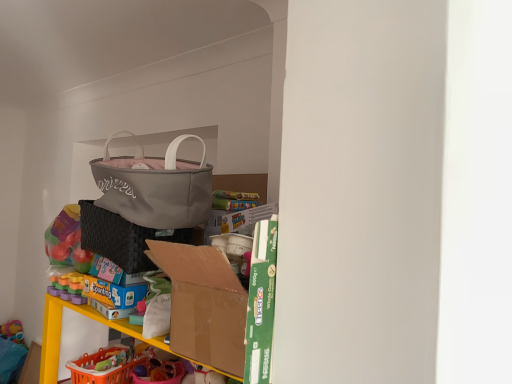
The image size is (512, 384). Describe the element at coordinates (203, 307) in the screenshot. I see `cardboard box at center` at that location.

This screenshot has width=512, height=384. Find the location of `cardboard box at center`. cardboard box at center is located at coordinates (203, 307).

The width and height of the screenshot is (512, 384). In order to click on cardboard box at center in this screenshot , I will do `click(203, 307)`.

Is cardboard box at center looking in the opposite direction of matte gray handbag at upper center?

No, cardboard box at center's orientation is not away from matte gray handbag at upper center.

Is the surface of cardboard box at center in direct contact with matte gray handbag at upper center?

No, cardboard box at center is not beside matte gray handbag at upper center.

From a real-world perspective, which object rests below the other?

cardboard box at center is physically lower.

Which of these two, cardboard box at center or matte gray handbag at upper center, is smaller?

Smaller between the two is matte gray handbag at upper center.

Is black woven laundry basket at center far away from cardboard box at center?

No, black woven laundry basket at center is not far from cardboard box at center.

Consider the image. Measure the distance between black woven laundry basket at center and cardboard box at center.

They are 9.94 inches apart.

Does point (128, 236) lie behind point (225, 307)?

Yes, point (128, 236) is farther from viewer.

In the image, is black woven laundry basket at center positioned in front of or behind cardboard box at center?

Clearly, black woven laundry basket at center is behind cardboard box at center.

From the image's perspective, would you say cardboard box at center is shown under black woven laundry basket at center?

Yes, from the image's perspective, cardboard box at center is beneath black woven laundry basket at center.

Can you confirm if cardboard box at center is shorter than black woven laundry basket at center?

No, cardboard box at center is not shorter than black woven laundry basket at center.

From a real-world perspective, which is physically above, cardboard box at center or black woven laundry basket at center?

From a 3D spatial view, black woven laundry basket at center is above.

Which is behind, point (205, 169) or point (87, 241)?

The point (87, 241) is farther.

Is matte gray handbag at upper center facing away from black woven laundry basket at center?

matte gray handbag at upper center does not have its back to black woven laundry basket at center.

Considering the relative sizes of matte gray handbag at upper center and black woven laundry basket at center in the image provided, is matte gray handbag at upper center bigger than black woven laundry basket at center?

Yes, matte gray handbag at upper center is bigger than black woven laundry basket at center.

Considering the sizes of objects matte gray handbag at upper center and black woven laundry basket at center in the image provided, who is thinner, matte gray handbag at upper center or black woven laundry basket at center?

Thinner between the two is matte gray handbag at upper center.

Which object is positioned more to the right, black woven laundry basket at center or matte gray handbag at upper center?

Positioned to the right is black woven laundry basket at center.

Considering the sizes of objects black woven laundry basket at center and matte gray handbag at upper center in the image provided, who is taller, black woven laundry basket at center or matte gray handbag at upper center?

matte gray handbag at upper center is taller.

Is black woven laundry basket at center positioned in front of matte gray handbag at upper center?

No, black woven laundry basket at center is further to the viewer.

Is black woven laundry basket at center outside of matte gray handbag at upper center?

Indeed, black woven laundry basket at center is completely outside matte gray handbag at upper center.

Based on their sizes in the image, would you say matte gray handbag at upper center is bigger or smaller than cardboard box at center?

Considering their sizes, matte gray handbag at upper center takes up less space than cardboard box at center.

Considering the relative sizes of matte gray handbag at upper center and cardboard box at center in the image provided, is matte gray handbag at upper center taller than cardboard box at center?

Yes.

Image resolution: width=512 pixels, height=384 pixels. In order to click on bookshelf that appears below the matte gray handbag at upper center (from a real-world perspective) in this screenshot , I will do `click(203, 307)`.

Identify the location of bookshelf that appears in front of the black woven laundry basket at center. Image resolution: width=512 pixels, height=384 pixels. (203, 307).

Looking at this image, which object lies nearer to the anchor point cardboard box at center, matte gray handbag at upper center or black woven laundry basket at center?

black woven laundry basket at center.

From the image, which object appears to be nearer to matte gray handbag at upper center, cardboard box at center or black woven laundry basket at center?

Based on the image, black woven laundry basket at center appears to be nearer to matte gray handbag at upper center.

Looking at the image, which one is located further to matte gray handbag at upper center, black woven laundry basket at center or cardboard box at center?

Based on the image, cardboard box at center appears to be further to matte gray handbag at upper center.

Based on their spatial positions, is matte gray handbag at upper center or cardboard box at center closer to black woven laundry basket at center?

The object closer to black woven laundry basket at center is matte gray handbag at upper center.

From the image, which object appears to be farther from black woven laundry basket at center, cardboard box at center or matte gray handbag at upper center?

Among the two, cardboard box at center is located further to black woven laundry basket at center.

Estimate the real-world distances between objects in this image. Which object is closer to cardboard box at center, black woven laundry basket at center or matte gray handbag at upper center?

black woven laundry basket at center is positioned closer to the anchor cardboard box at center.

Identify the location of handbag between cardboard box at center and black woven laundry basket at center in the front-back direction. This screenshot has width=512, height=384. (155, 186).